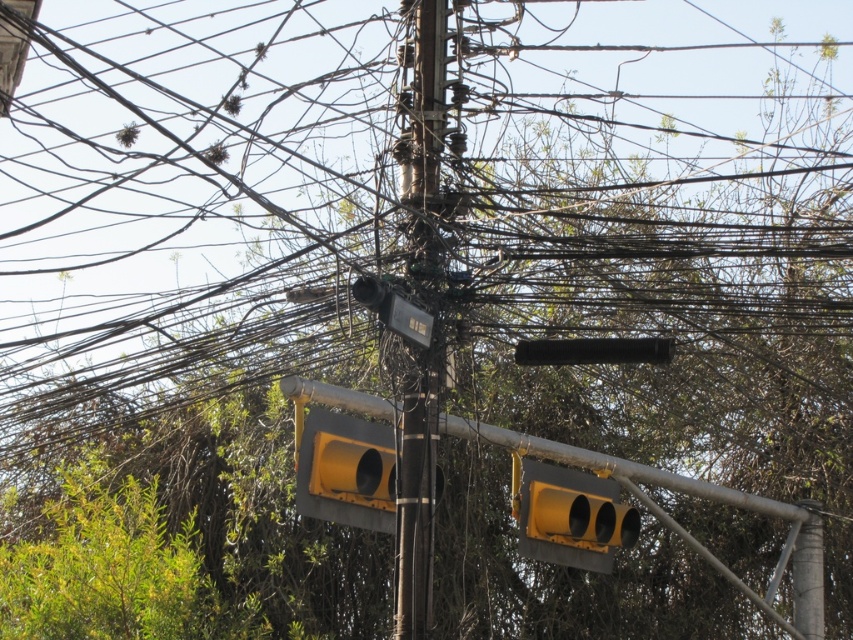
You are a drone operator trying to capture a closeup of the traffic lights mounted on the utility pole. You notice two points of interest marked as point (436, 202) and point (627, 516). Which point should you focus on to get a closer shot without moving the drone?

Point (436, 202) is closer to the camera than point (627, 516), so focusing on point (436, 202) will provide a closer shot without moving the drone.

You are a pedestrian standing at the intersection and see the metallic pole at center and the yellow matte traffic light at lower center. Which object is nearer to you?

The metallic pole at center is closer to the viewer than the yellow matte traffic light at lower center.